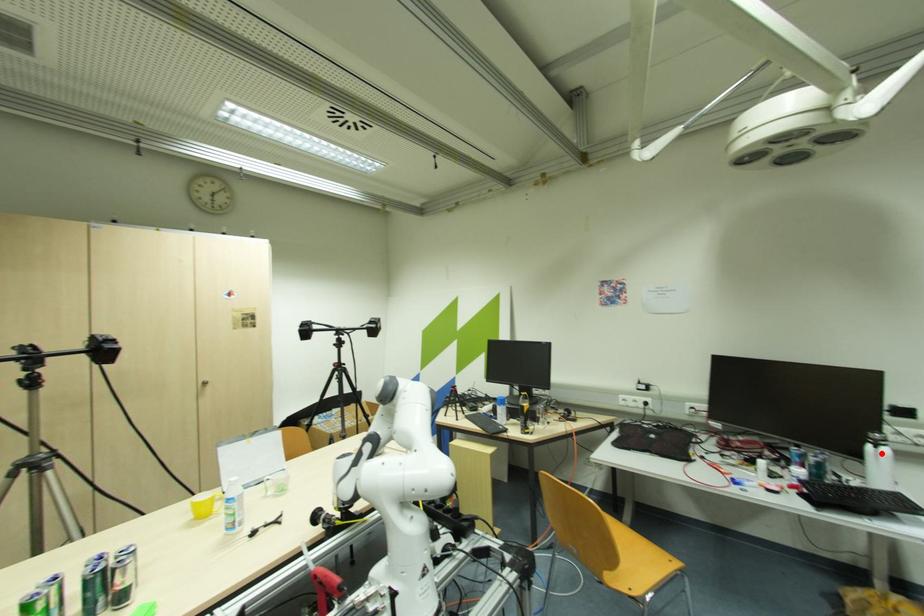
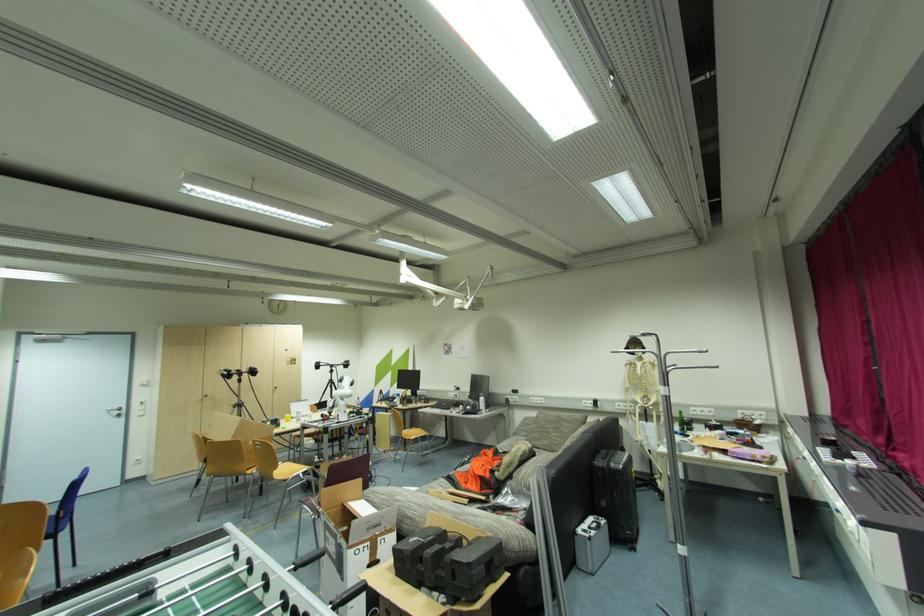
Question: I am providing you with two images of the same scene from different viewpoints. Image1 has a red point marked. In image2, the corresponding 3D location appears at what relative position? Reply with the corresponding letter.

Choices:
 (A) Closer
 (B) Farther

Answer: (B)